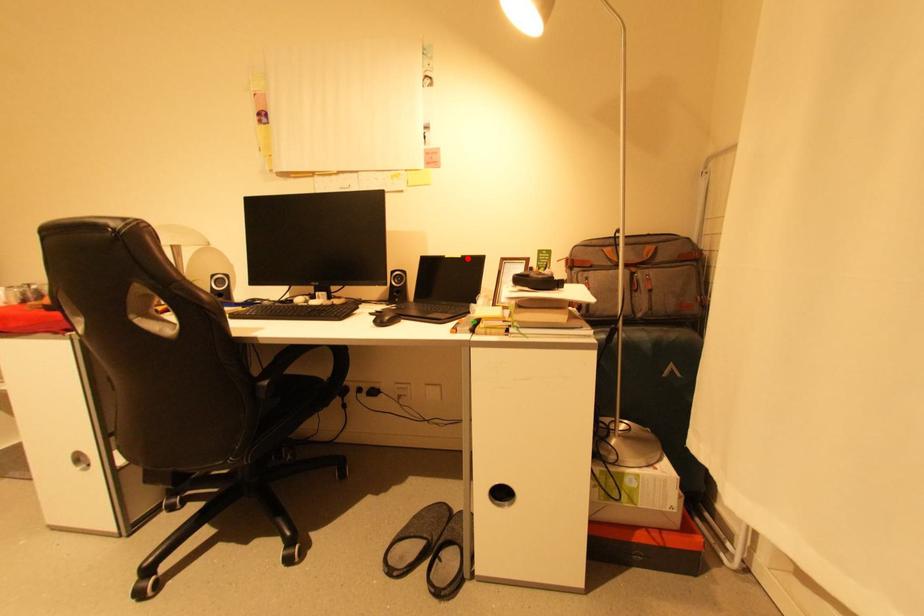
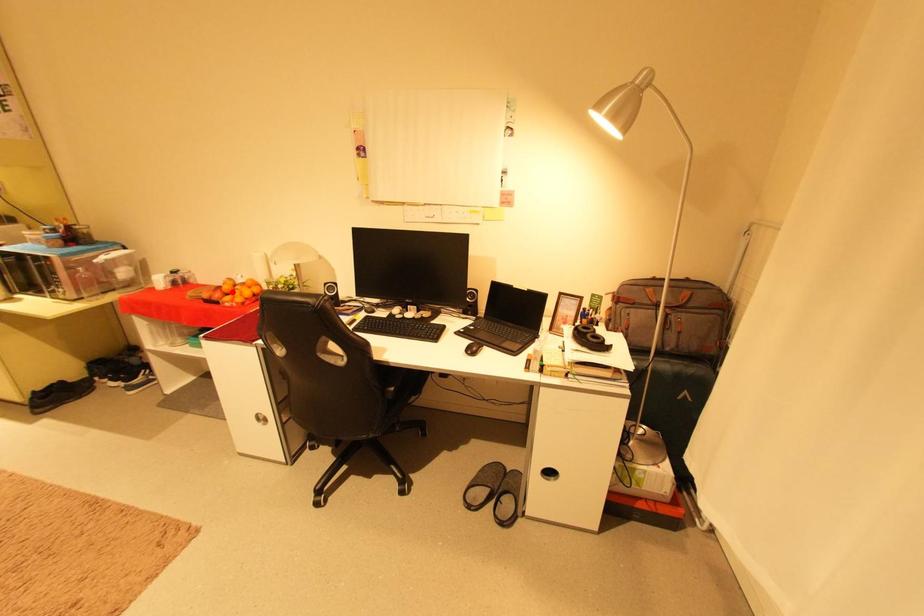
I am providing you with two images of the same scene from different viewpoints. A red point is marked on the first image and another point is marked on the second image. Is the marked point in image1 the same physical position as the marked point in image2?

No